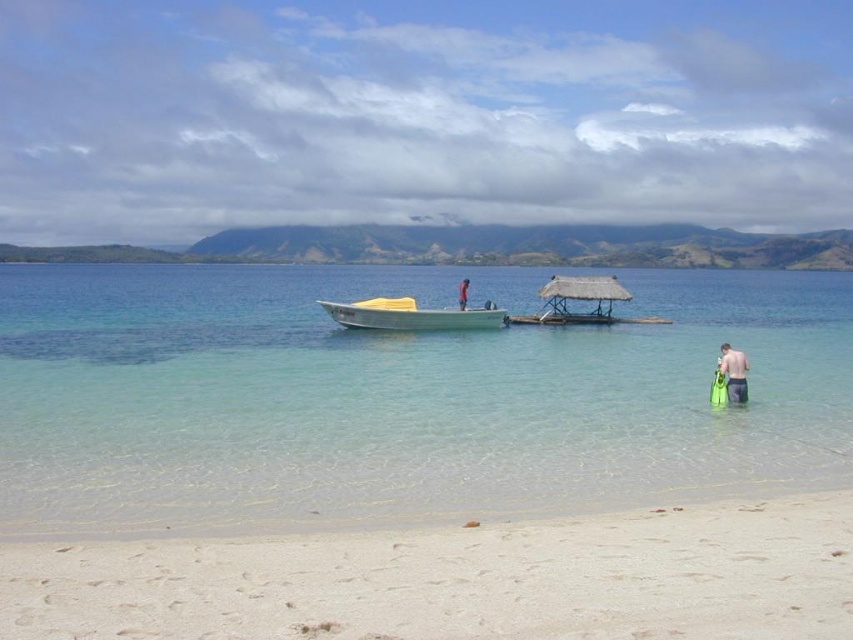
Consider the image. Who is lower down, clear water at beach center or skinny man at center?

Positioned lower is skinny man at center.

Does clear water at beach center come in front of skinny man at center?

Yes, clear water at beach center is in front of skinny man at center.

Between point (831, 440) and point (466, 278), which one is positioned in front?

Positioned in front is point (831, 440).

The image size is (853, 640). I want to click on clear water at beach center, so click(397, 397).

Does white sandy beach at lower center appear on the right side of skinny man at center?

Indeed, white sandy beach at lower center is positioned on the right side of skinny man at center.

Can you confirm if white sandy beach at lower center is bigger than skinny man at center?

Incorrect, white sandy beach at lower center is not larger than skinny man at center.

Which is in front, point (256, 552) or point (457, 307)?

Point (256, 552) is more forward.

Find the location of a particular element. Image resolution: width=853 pixels, height=640 pixels. white sandy beach at lower center is located at coordinates (457, 579).

Looking at this image, between white glossy boat at center and skinny man at lower right, which one is positioned lower?

skinny man at lower right

Does white glossy boat at center come in front of skinny man at lower right?

No, white glossy boat at center is further to the viewer.

Locate an element on the screen. white glossy boat at center is located at coordinates (410, 316).